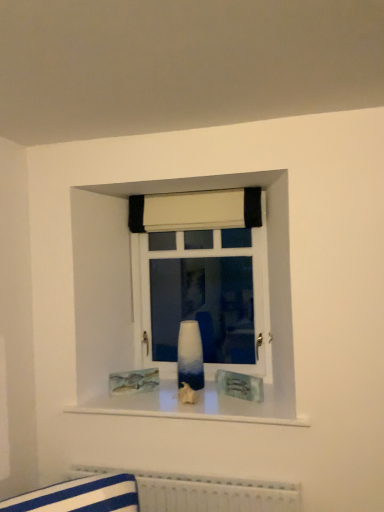
Question: Is white fabric curtain at upper center located outside blue glossy vase at center?

Choices:
 (A) yes
 (B) no

Answer: (A)

Question: Is white fabric curtain at upper center oriented towards blue glossy vase at center?

Choices:
 (A) no
 (B) yes

Answer: (A)

Question: Considering the relative sizes of white fabric curtain at upper center and blue glossy vase at center in the image provided, is white fabric curtain at upper center wider than blue glossy vase at center?

Choices:
 (A) no
 (B) yes

Answer: (A)

Question: Considering the relative sizes of white fabric curtain at upper center and blue glossy vase at center in the image provided, is white fabric curtain at upper center smaller than blue glossy vase at center?

Choices:
 (A) no
 (B) yes

Answer: (A)

Question: Is white fabric curtain at upper center at the left side of blue glossy vase at center?

Choices:
 (A) yes
 (B) no

Answer: (B)

Question: From a real-world perspective, is white fabric curtain at upper center physically below blue glossy vase at center?

Choices:
 (A) no
 (B) yes

Answer: (A)

Question: Is blue glossy vase at center shorter than white textured radiator at lower center?

Choices:
 (A) yes
 (B) no

Answer: (B)

Question: From the image's perspective, would you say blue glossy vase at center is shown under white textured radiator at lower center?

Choices:
 (A) no
 (B) yes

Answer: (A)

Question: Is there a large distance between blue glossy vase at center and white textured radiator at lower center?

Choices:
 (A) no
 (B) yes

Answer: (A)

Question: From a real-world perspective, does blue glossy vase at center stand above white textured radiator at lower center?

Choices:
 (A) no
 (B) yes

Answer: (B)

Question: Considering the relative sizes of blue glossy vase at center and white textured radiator at lower center in the image provided, is blue glossy vase at center thinner than white textured radiator at lower center?

Choices:
 (A) yes
 (B) no

Answer: (A)

Question: From a real-world perspective, is blue glossy vase at center physically below white textured radiator at lower center?

Choices:
 (A) yes
 (B) no

Answer: (B)

Question: From a real-world perspective, is white fabric curtain at upper center on top of ombre glass vase at center?

Choices:
 (A) yes
 (B) no

Answer: (A)